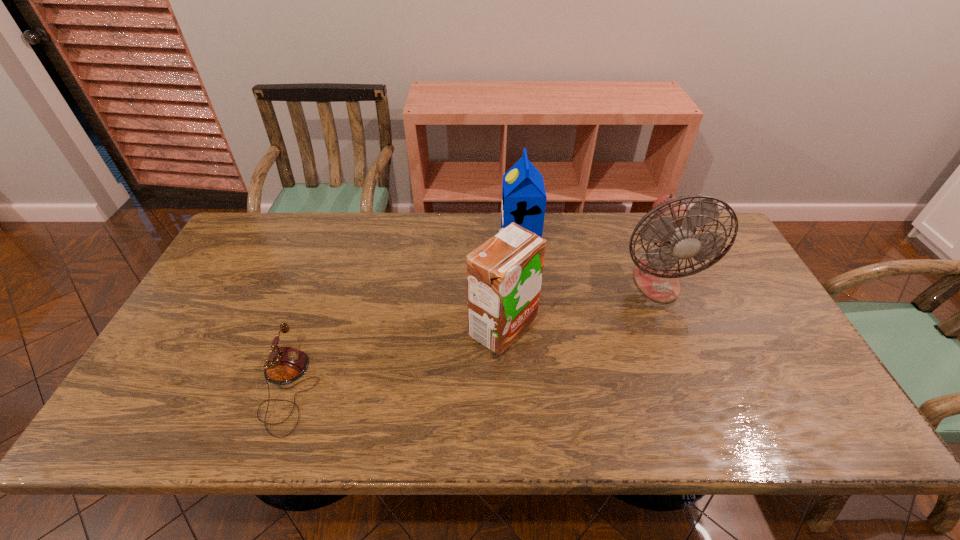
Find the location of a particular element. This screenshot has width=960, height=540. vacant area at the left edge of the desktop is located at coordinates click(x=271, y=265).

At what (x,y) coordinates should I click in order to perform the action: click on vacant space at the right edge of the desktop. Please return your answer as a coordinate pair (x, y). Looking at the image, I should click on (718, 287).

Locate an element on the screen. free space at the far left corner of the desktop is located at coordinates (260, 237).

In order to click on blank region between the farther carton and the shortest object in this screenshot , I will do `click(403, 314)`.

Find the location of a particular element. The image size is (960, 540). blank region between the nearer carton and the rightmost object is located at coordinates (580, 304).

I want to click on empty space that is in between the rightmost object and the nearer carton, so click(580, 304).

The image size is (960, 540). In order to click on vacant area between the fan and the nearer carton in this screenshot , I will do `click(580, 304)`.

This screenshot has height=540, width=960. In order to click on unoccupied area between the farther carton and the fan in this screenshot , I will do `click(588, 261)`.

At what (x,y) coordinates should I click in order to perform the action: click on free space between the telephone and the farthest object. Please return your answer as a coordinate pair (x, y). This screenshot has width=960, height=540. Looking at the image, I should click on (403, 314).

Locate an element on the screen. This screenshot has height=540, width=960. empty location between the nearer carton and the fan is located at coordinates pyautogui.click(x=580, y=304).